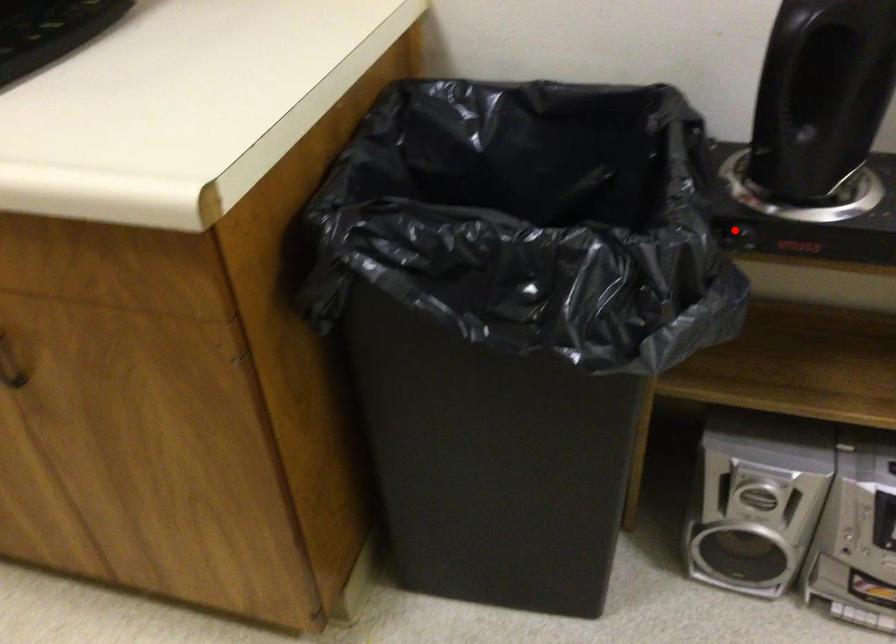
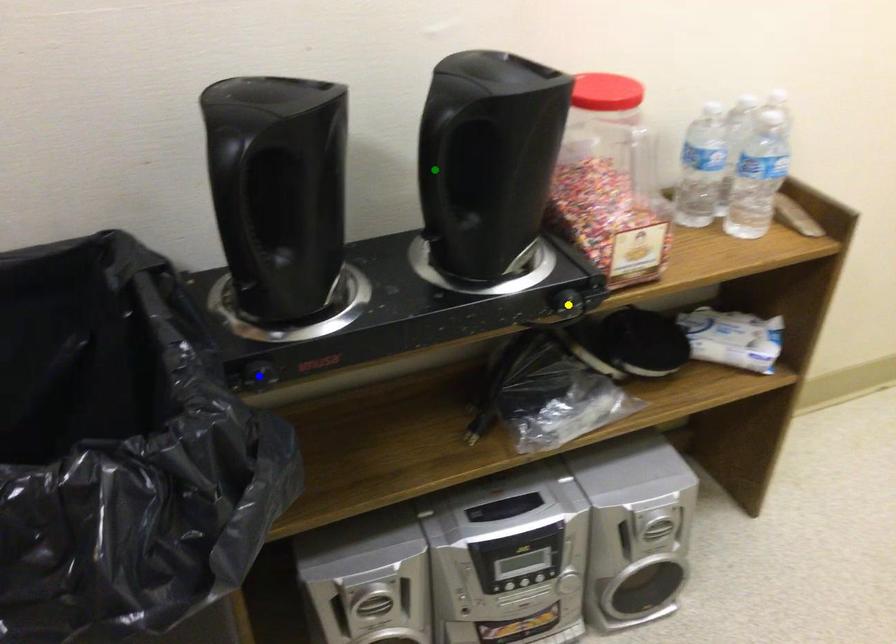
Question: I am providing you with two images of the same scene from different viewpoints. A red point is marked on the first image. You are given multiple points on the second image. In image 2, which mark is for the same physical point as the one in image 1?

Choices:
 (A) yellow point
 (B) green point
 (C) blue point

Answer: (C)